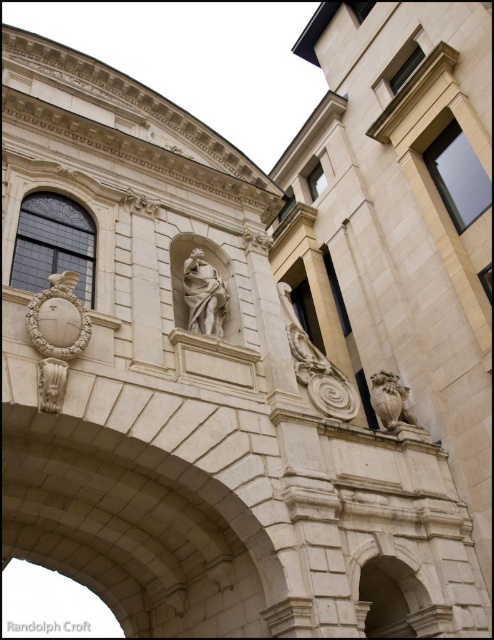
Question: Does white marble statue at center appear on the right side of stone lion at center right?

Choices:
 (A) no
 (B) yes

Answer: (A)

Question: Where is white marble statue at center located in relation to stone lion at center right in the image?

Choices:
 (A) below
 (B) above

Answer: (B)

Question: Which point is closer to the camera?

Choices:
 (A) (200, 253)
 (B) (62, 384)

Answer: (B)

Question: Does white marble statue at center appear on the right side of stone lion at center right?

Choices:
 (A) yes
 (B) no

Answer: (B)

Question: Which point is closer to the camera?

Choices:
 (A) white marble statue at center
 (B) stone lion at center right
 (C) matte stone sculpture at lower left

Answer: (C)

Question: Based on their relative distances, which object is nearer to the stone lion at center right?

Choices:
 (A) matte stone sculpture at lower left
 (B) white marble statue at center

Answer: (B)